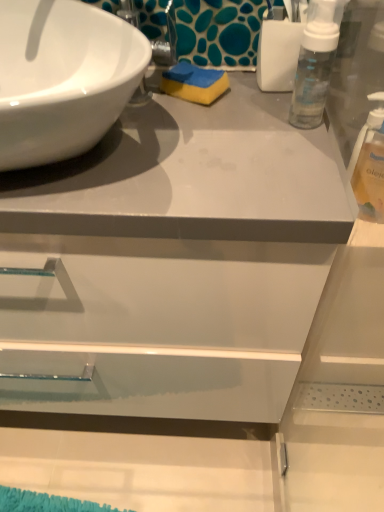
You are a GUI agent. You are given a task and a screenshot of the screen. Output one action in this format:
    pyautogui.click(x=<x>, y=<y>)
    Task: Click on the vacant space to the right of white glossy sink at upper left
    This screenshot has height=512, width=384.
    Given the screenshot: What is the action you would take?
    pyautogui.click(x=229, y=135)